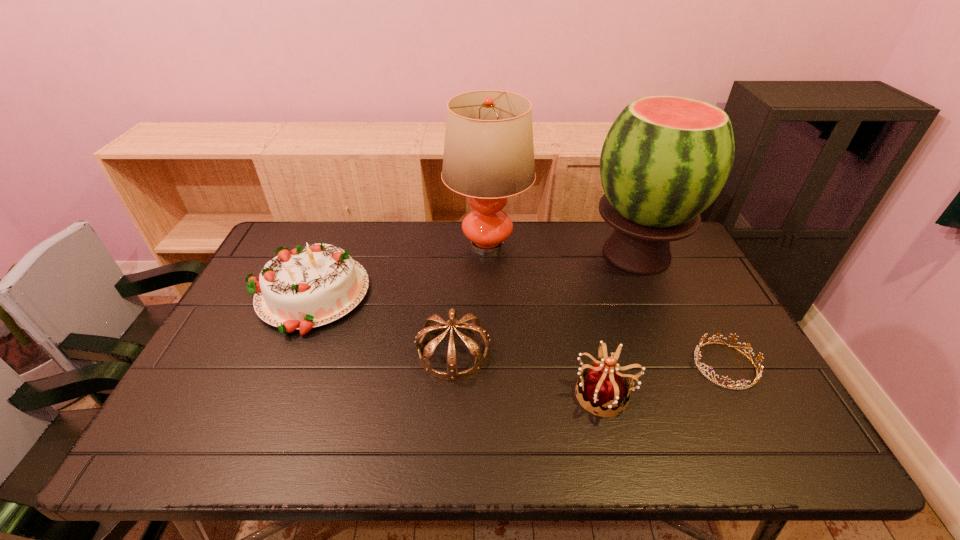
Find the location of a particular element. Image resolution: width=960 pixels, height=540 pixels. vacant area that lies between the fifth tallest object and the second tiara from left to right is located at coordinates (529, 373).

The image size is (960, 540). Identify the location of vacant area that lies between the tallest tiara and the shortest tiara. (664, 380).

Where is `unoccupied area between the leftmost object and the rightmost tiara`? The image size is (960, 540). unoccupied area between the leftmost object and the rightmost tiara is located at coordinates (516, 330).

Image resolution: width=960 pixels, height=540 pixels. In order to click on vacant space that is in between the second tiara from left to right and the leftmost tiara in this screenshot , I will do (529, 373).

This screenshot has height=540, width=960. I want to click on object that stands as the fourth closest to the watermelon, so click(x=429, y=328).

Where is `the fourth closest object to the tallest tiara`? Image resolution: width=960 pixels, height=540 pixels. the fourth closest object to the tallest tiara is located at coordinates (488, 156).

Identify which tiara is the second nearest to the leftmost tiara. Please provide its 2D coordinates. Your answer should be formatted as a tuple, i.e. [(x, y)], where the tuple contains the x and y coordinates of a point satisfying the conditions above.

[(758, 375)]

Point out which tiara is positioned as the second nearest to the lamp. Please provide its 2D coordinates. Your answer should be formatted as a tuple, i.e. [(x, y)], where the tuple contains the x and y coordinates of a point satisfying the conditions above.

[(604, 386)]

Where is `free space that satisfies the following two spatial constraints: 1. on the back side of the watermelon; 2. on the right side of the fifth tallest object`? This screenshot has width=960, height=540. free space that satisfies the following two spatial constraints: 1. on the back side of the watermelon; 2. on the right side of the fifth tallest object is located at coordinates (459, 254).